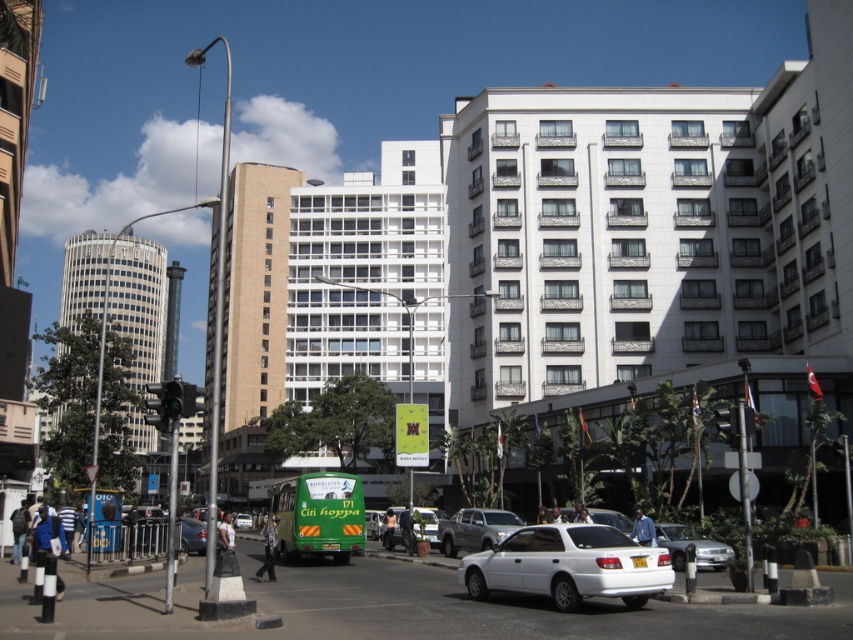
You are a pedestrian standing at the intersection and want to cross the street to the park on the other side. There are two cars in your path. The silver metallic sedan at lower right and the white glossy sedan at center. Which car is closer to the right side of the street?

The silver metallic sedan at lower right is to the right of the white glossy sedan at center, so it is closer to the right side of the street.

You are standing at the intersection and see a point marked at coordinates (643, 529). According to the scene description, where is this point located?

The point at coordinates (643, 529) is located on the blue shirt at center.